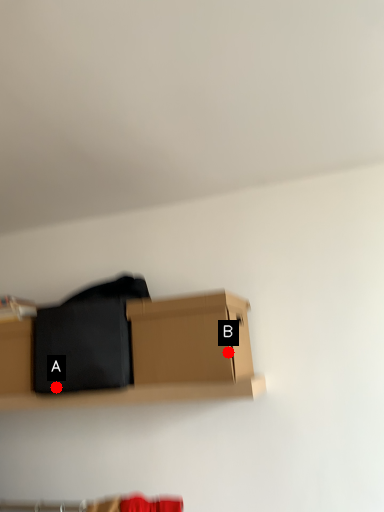
Question: Two points are circled on the image, labeled by A and B beside each circle. Which of the following is the closest to the observer?

Choices:
 (A) A is closer
 (B) B is closer

Answer: (B)